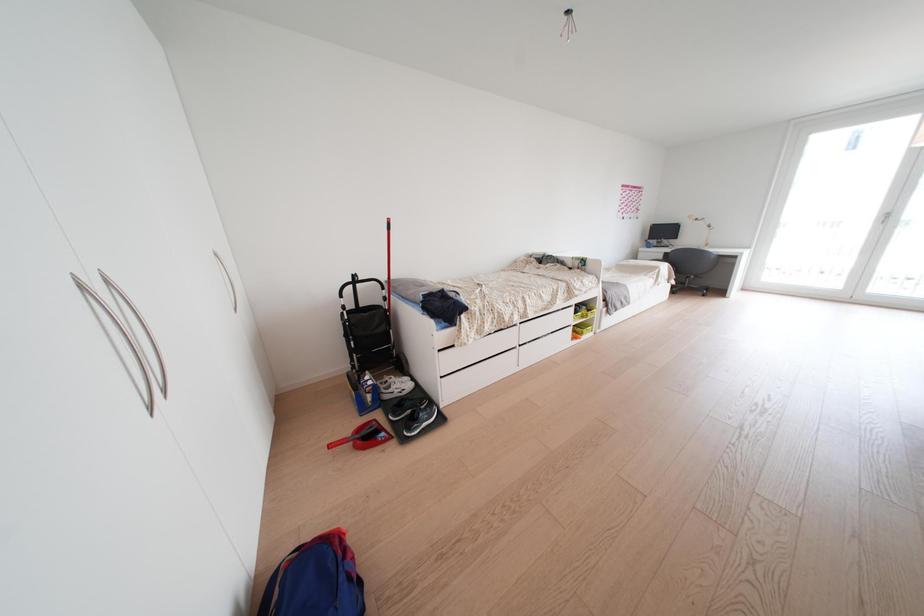
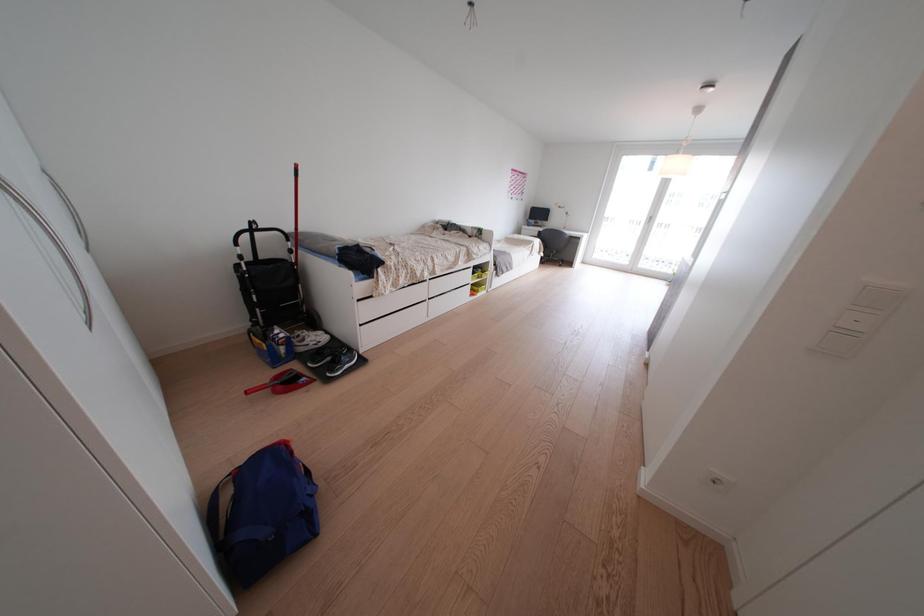
Question: How did the camera likely rotate?

Choices:
 (A) Left
 (B) Right
 (C) Up
 (D) Down

Answer: (B)